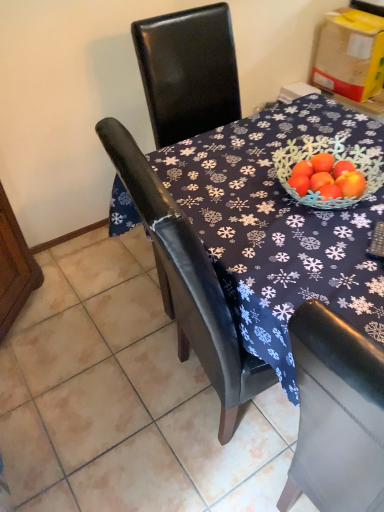
Question: From a real-world perspective, relative to yellow cardboard box at upper right, is matte black chair at center vertically above or below?

Choices:
 (A) below
 (B) above

Answer: (A)

Question: From the image's perspective, is matte black chair at center located above or below yellow cardboard box at upper right?

Choices:
 (A) above
 (B) below

Answer: (B)

Question: Is matte black chair at center bigger or smaller than yellow cardboard box at upper right?

Choices:
 (A) small
 (B) big

Answer: (B)

Question: Is yellow cardboard box at upper right wider or thinner than matte black chair at center?

Choices:
 (A) thin
 (B) wide

Answer: (A)

Question: Choose the correct answer: Is yellow cardboard box at upper right inside matte black chair at center or outside it?

Choices:
 (A) inside
 (B) outside

Answer: (B)

Question: From the image's perspective, is yellow cardboard box at upper right above or below matte black chair at center?

Choices:
 (A) above
 (B) below

Answer: (A)

Question: In terms of height, does yellow cardboard box at upper right look taller or shorter compared to matte black chair at center?

Choices:
 (A) short
 (B) tall

Answer: (B)